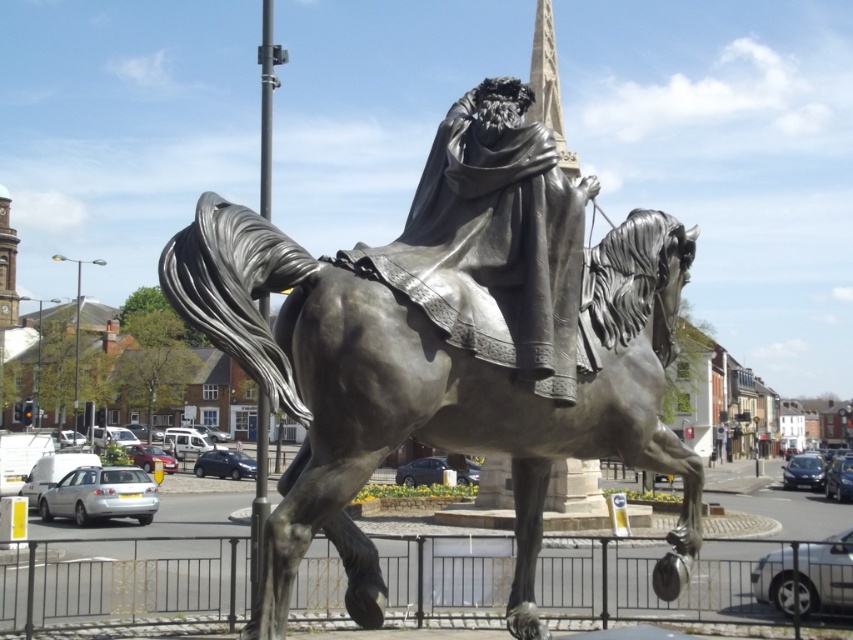
Question: Which point is closer to the camera?

Choices:
 (A) bronze statue at center
 (B) bronze draped figure at center

Answer: (A)

Question: Does bronze statue at center appear on the left side of bronze draped figure at center?

Choices:
 (A) yes
 (B) no

Answer: (B)

Question: Can you confirm if bronze statue at center is smaller than bronze draped figure at center?

Choices:
 (A) yes
 (B) no

Answer: (B)

Question: Which point is closer to the camera?

Choices:
 (A) 560,321
 (B) 537,512

Answer: (A)

Question: Is bronze statue at center positioned behind bronze draped figure at center?

Choices:
 (A) no
 (B) yes

Answer: (A)